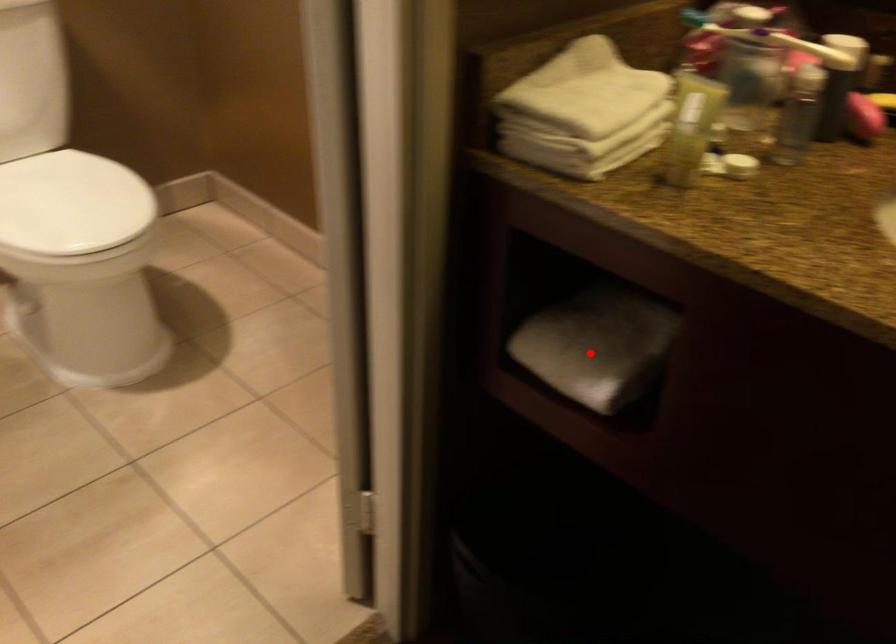
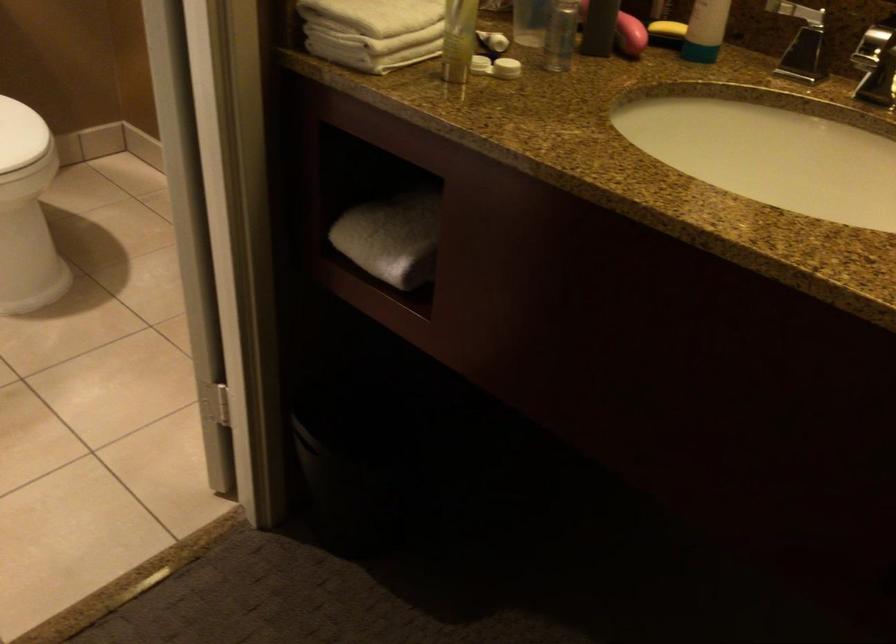
In the second image, find the point that corresponds to the highlighted location in the first image.

(392, 238)